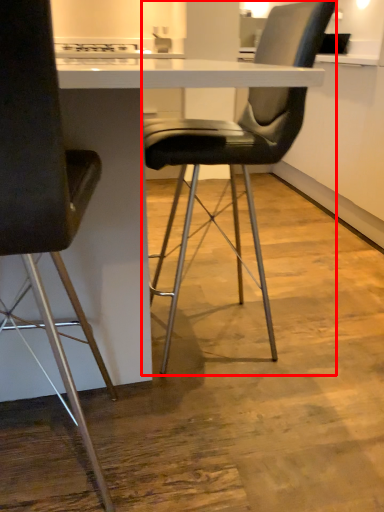
Question: From the image's perspective, what is the correct spatial positioning of chair (annotated by the red box) in reference to chair?

Choices:
 (A) below
 (B) above

Answer: (B)